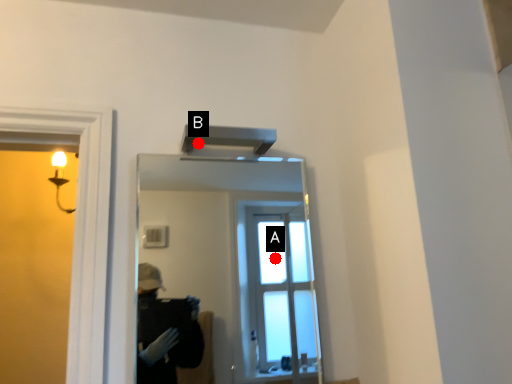
Question: Two points are circled on the image, labeled by A and B beside each circle. Which point appears closest to the camera in this image?

Choices:
 (A) A is closer
 (B) B is closer

Answer: (B)